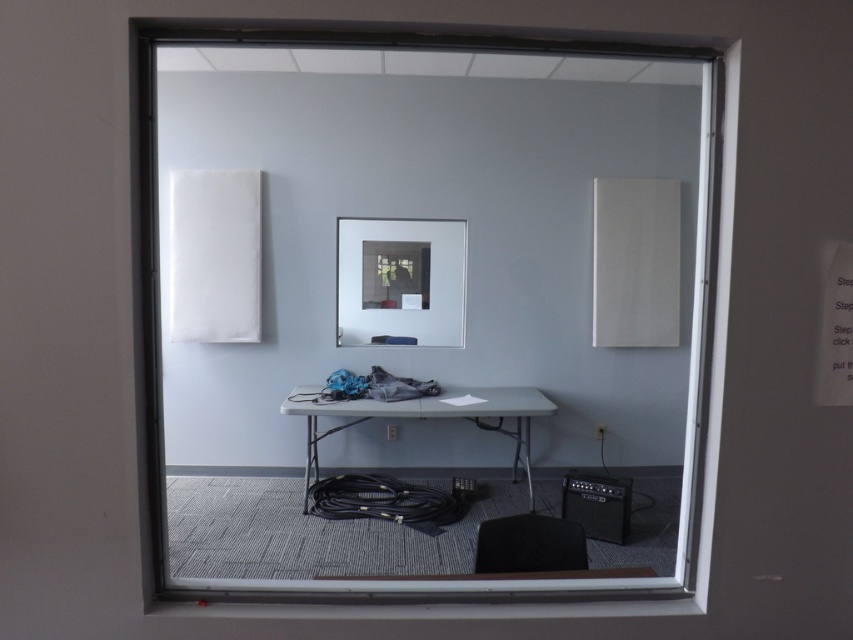
You are standing in front of the window and want to see your reflection in the clear glass mirror at center. Is the mirror positioned in a way that you can see your reflection?

The clear glass mirror at center is positioned at point (399,280), which is directly in front of you, so you can see your reflection.

You are standing in a room and see both the transparent glass window at center and the clear glass mirror at center. Which object is closer to you?

The transparent glass window at center is closer to you since it is in front of the clear glass mirror at center.